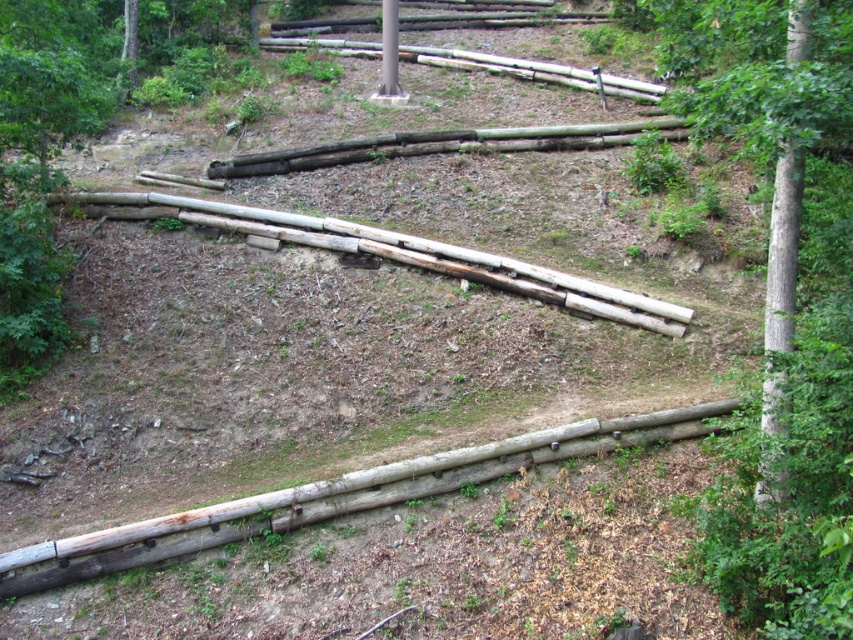
Question: Which of the following is the farthest from the observer?

Choices:
 (A) (772, 486)
 (B) (38, 552)
 (C) (788, 330)

Answer: (B)

Question: Which object is closer to the camera taking this photo?

Choices:
 (A) smooth brown tree trunk at right
 (B) smooth gray bark tree at right
 (C) weathered wood at lower center

Answer: (A)

Question: Can you confirm if smooth gray bark tree at right is positioned above smooth brown tree trunk at right?

Choices:
 (A) yes
 (B) no

Answer: (A)

Question: Is smooth gray bark tree at right closer to the viewer compared to smooth brown tree trunk at right?

Choices:
 (A) no
 (B) yes

Answer: (A)

Question: Does smooth gray bark tree at right have a larger size compared to smooth brown tree trunk at right?

Choices:
 (A) no
 (B) yes

Answer: (A)

Question: Which of these objects is positioned closest to the weathered wood at lower center?

Choices:
 (A) smooth brown tree trunk at right
 (B) smooth gray bark tree at right

Answer: (A)